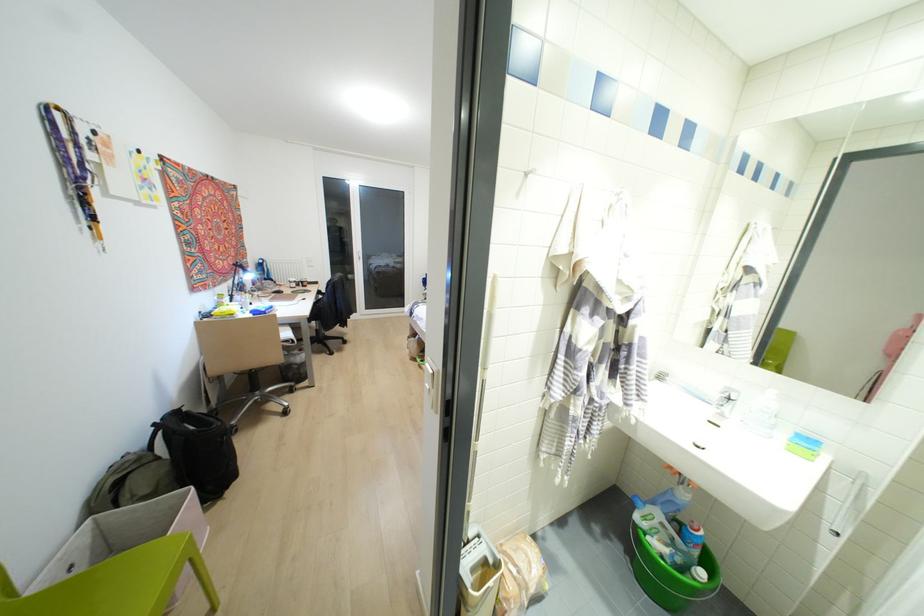
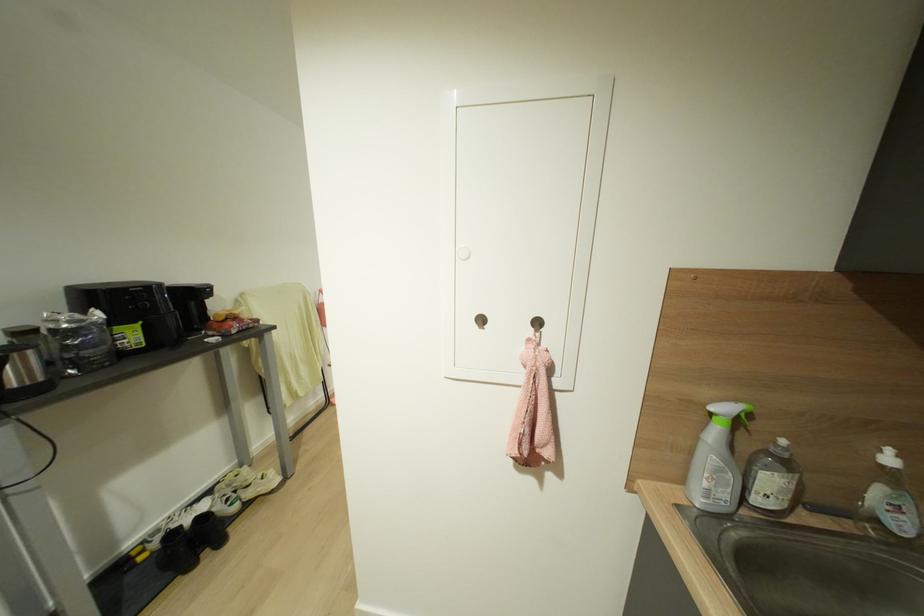
Question: I am providing you with two images of the same scene from different viewpoints. Please identify which objects are invisible in image2.

Choices:
 (A) white bottle pump
 (B) green backpack
 (C) green spray trigger
 (D) white desk lamp head

Answer: (B)